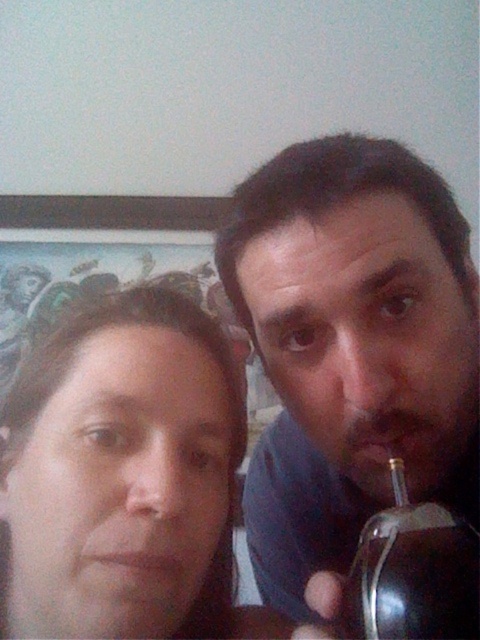
Which is behind, point (445, 225) or point (451, 634)?

Point (445, 225)

What do you see at coordinates (351, 348) in the screenshot? I see `matte black cup at right` at bounding box center [351, 348].

Is point (346, 316) positioned behind point (388, 637)?

Yes, point (346, 316) is farther from viewer.

This screenshot has width=480, height=640. Identify the location of matte black cup at right. (351, 348).

Consider the image. Measure the distance between point (189,554) and camera.

The distance of point (189,554) from camera is 14.49 inches.

Between point (120, 298) and point (462, 548), which one is positioned behind?

Positioned behind is point (120, 298).

The width and height of the screenshot is (480, 640). I want to click on matte black hair at center, so click(126, 476).

The width and height of the screenshot is (480, 640). What do you see at coordinates (351, 348) in the screenshot? I see `matte black cup at right` at bounding box center [351, 348].

Is matte black cup at right above matte black hair at center?

Yes, matte black cup at right is above matte black hair at center.

Who is more forward, (257, 464) or (157, 385)?

Point (157, 385) is in front.

The height and width of the screenshot is (640, 480). Identify the location of matte black cup at right. (351, 348).